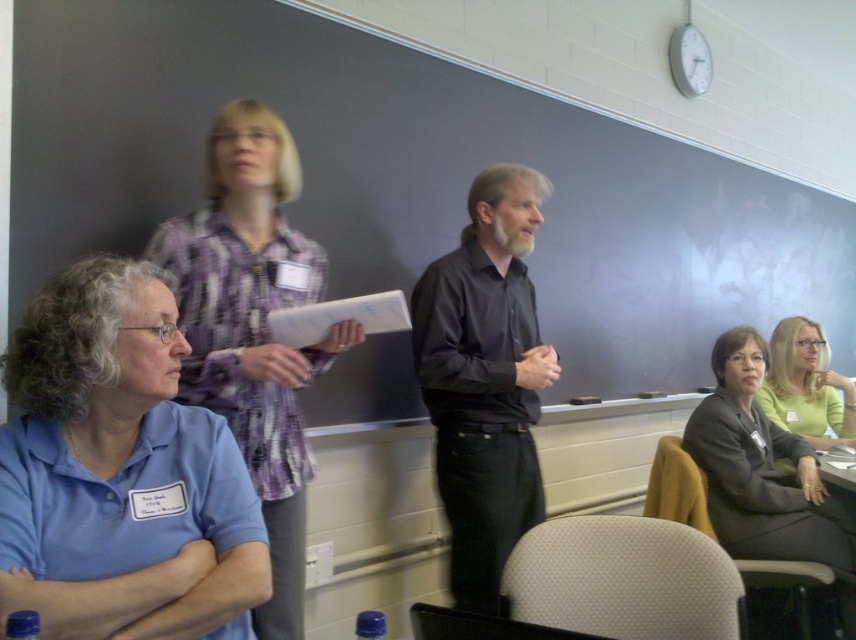
Question: Is plaid shirt at upper left closer to the viewer compared to matte gray suit at lower right?

Choices:
 (A) yes
 (B) no

Answer: (A)

Question: Does plaid shirt at upper left have a smaller size compared to black smooth shirt at center?

Choices:
 (A) no
 (B) yes

Answer: (A)

Question: Which point is closer to the camera?

Choices:
 (A) black smooth shirt at center
 (B) matte gray suit at lower right
 (C) light green shirt at lower right

Answer: (A)

Question: Which point is farther to the camera?

Choices:
 (A) matte gray suit at lower right
 (B) light green shirt at lower right
 (C) plaid shirt at upper left
 (D) blue cotton shirt at lower left

Answer: (B)

Question: Estimate the real-world distances between objects in this image. Which object is farther from the matte gray suit at lower right?

Choices:
 (A) light green shirt at lower right
 (B) black smooth shirt at center
 (C) plaid shirt at upper left
 (D) blue cotton shirt at lower left

Answer: (D)

Question: Is matte gray suit at lower right wider than light green shirt at lower right?

Choices:
 (A) yes
 (B) no

Answer: (B)